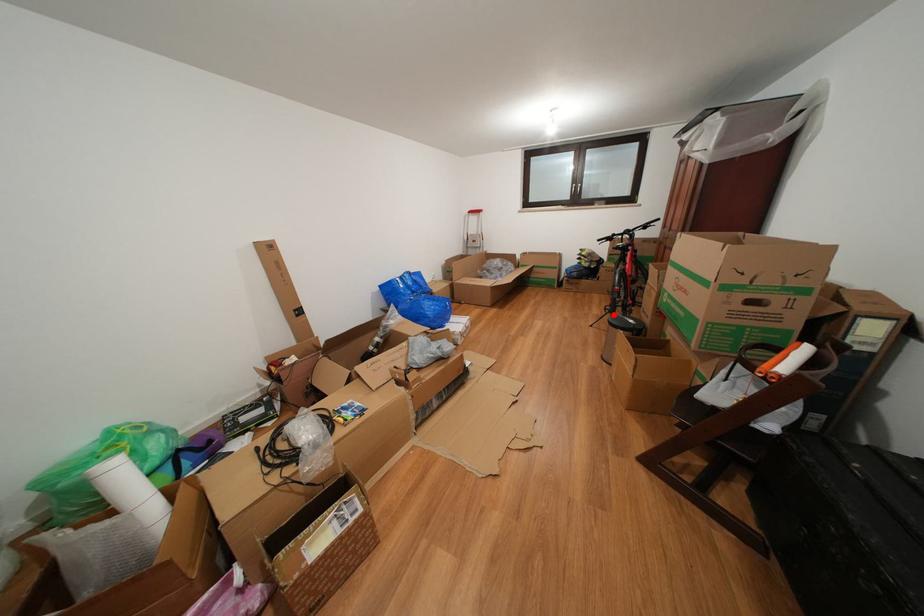
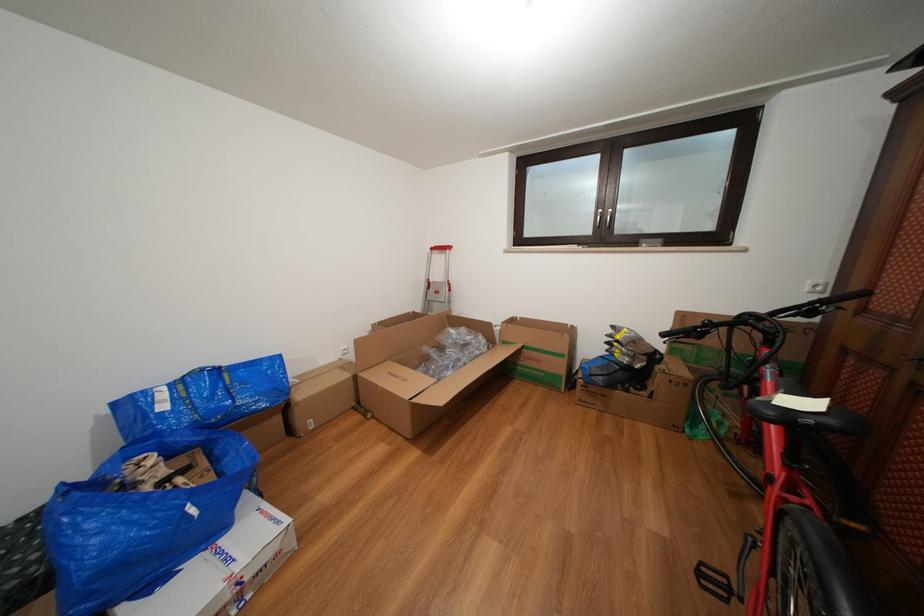
Question: I am providing you with two images of the same scene from different viewpoints. In image1, a red point is highlighted. Considering the same 3D point in image2, which of the following is correct?

Choices:
 (A) It is closer
 (B) It is farther

Answer: (B)